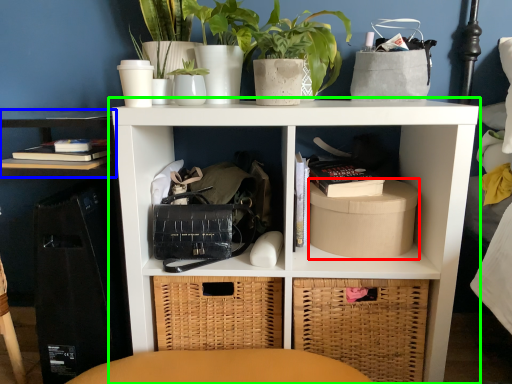
Question: Which object is the farthest from cardboard box (highlighted by a red box)? Choose among these: shelf (highlighted by a blue box) or shelf (highlighted by a green box).

Choices:
 (A) shelf
 (B) shelf

Answer: (A)